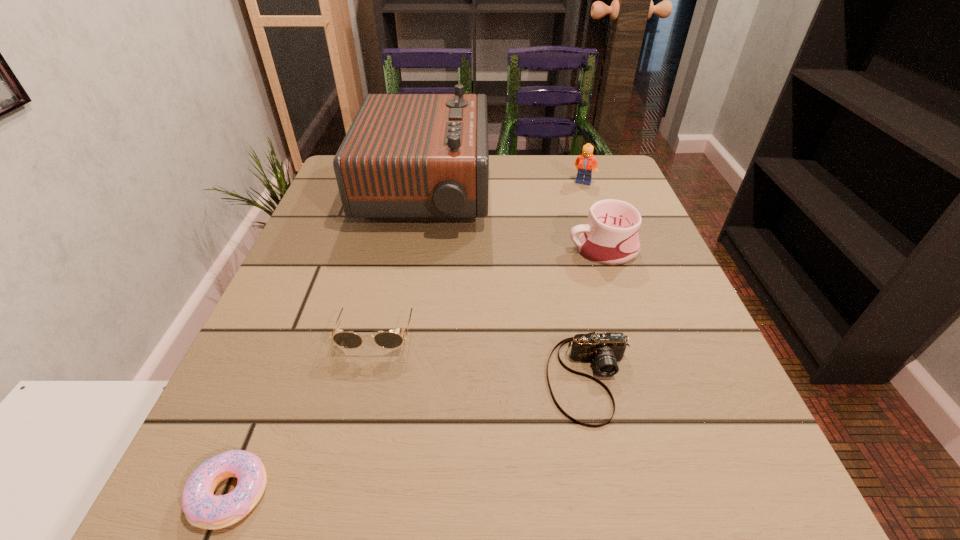
What are the coordinates of `free space located on the side with the handle of the mug` in the screenshot? It's located at pyautogui.click(x=397, y=249).

At what (x,y) coordinates should I click in order to perform the action: click on vacant space positioned on the side with the handle of the mug. Please return your answer as a coordinate pair (x, y). Looking at the image, I should click on (460, 249).

At what (x,y) coordinates should I click in order to perform the action: click on vacant area located 0.080m on the front lenses of the third shortest object. Please return your answer as a coordinate pair (x, y). Looking at the image, I should click on (362, 400).

Image resolution: width=960 pixels, height=540 pixels. I want to click on vacant position located 0.110m on the front-facing side of the camera, so click(619, 511).

The width and height of the screenshot is (960, 540). Find the location of `vacant area located 0.220m on the right of the nearest object`. vacant area located 0.220m on the right of the nearest object is located at coordinates (445, 494).

Locate an element on the screen. This screenshot has width=960, height=540. radio receiver located in the far edge section of the desktop is located at coordinates (406, 157).

In order to click on Lego present at the far edge in this screenshot , I will do `click(586, 162)`.

Locate an element on the screen. object located in the near edge section of the desktop is located at coordinates point(202,509).

At what (x,y) coordinates should I click in order to perform the action: click on radio receiver present at the left edge. Please return your answer as a coordinate pair (x, y). The height and width of the screenshot is (540, 960). Looking at the image, I should click on (406, 157).

This screenshot has height=540, width=960. I want to click on sunglasses situated at the left edge, so click(389, 340).